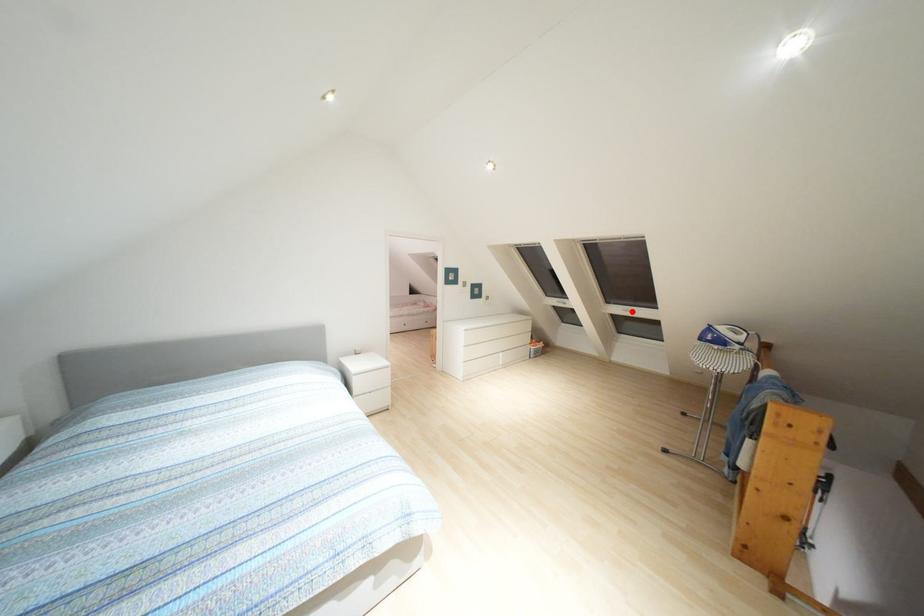
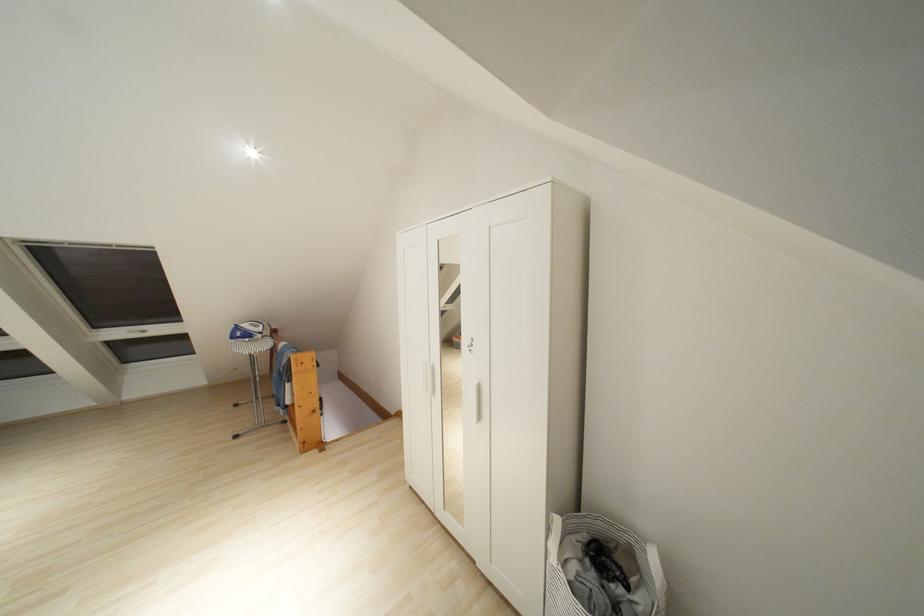
Question: I am providing you with two images of the same scene from different viewpoints. Image1 has a red point marked. In image2, the corresponding 3D location appears at what relative position? Reply with the corresponding letter.

Choices:
 (A) Closer
 (B) Farther

Answer: (B)